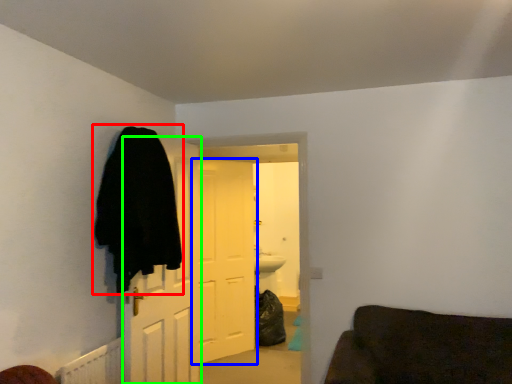
Question: Based on their relative distances, which object is nearer to cloak (highlighted by a red box)? Choose from door (highlighted by a blue box) and door (highlighted by a green box).

Choices:
 (A) door
 (B) door

Answer: (B)